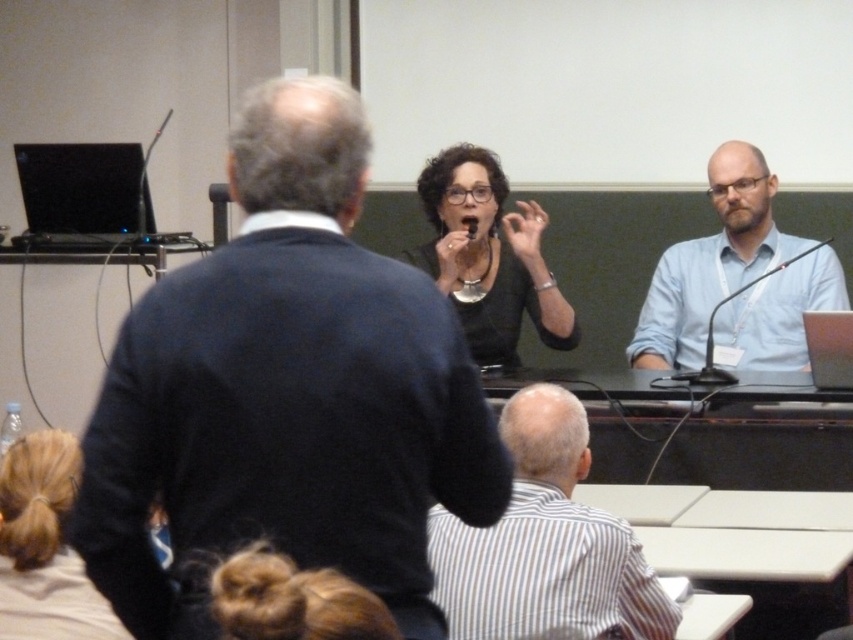
In the conference setting, there are two shirts visible in the image. The first is a white striped shirt at lower center, and the second is a matte black shirt at center. Based on their positions, which shirt is located to the right of the other?

The white striped shirt at lower center is to the right of the matte black shirt at center.